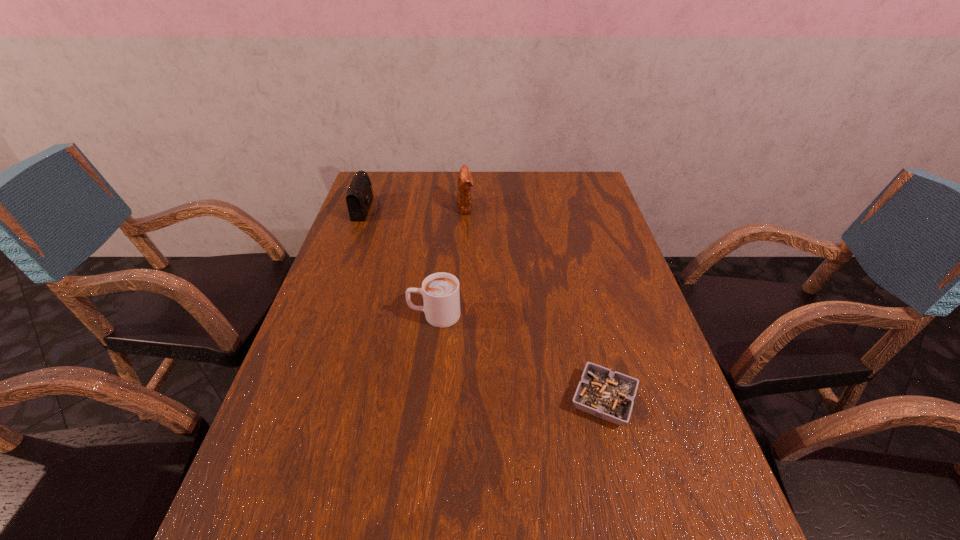
The width and height of the screenshot is (960, 540). In order to click on free space that satisfies the following two spatial constraints: 1. on the open side of the shortest object; 2. on the left side of the taller clutch bag in this screenshot , I will do `click(457, 400)`.

This screenshot has height=540, width=960. Find the location of `vacant area in the image that satisfies the following two spatial constraints: 1. on the side with the handle of the second nearest object; 2. on the back side of the rightmost object`. vacant area in the image that satisfies the following two spatial constraints: 1. on the side with the handle of the second nearest object; 2. on the back side of the rightmost object is located at coordinates [x=425, y=400].

This screenshot has height=540, width=960. Identify the location of vacant space that satisfies the following two spatial constraints: 1. on the front flap of the shorter clutch bag; 2. on the back side of the nearest object. (297, 400).